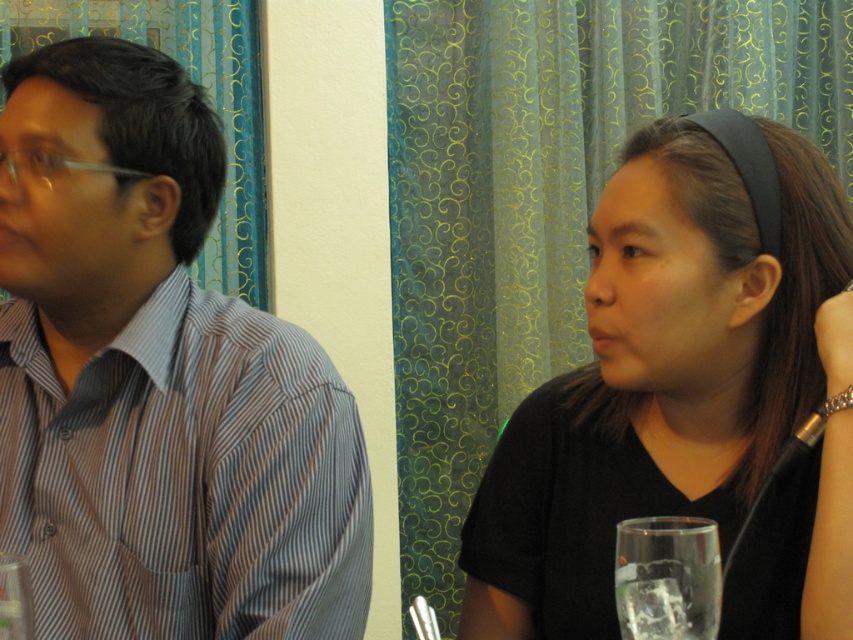
Can you confirm if striped cotton shirt at left is wider than black matte shirt at center?

Yes.

Does striped cotton shirt at left appear on the left side of black matte shirt at center?

Indeed, striped cotton shirt at left is positioned on the left side of black matte shirt at center.

Describe the element at coordinates (157, 380) in the screenshot. The height and width of the screenshot is (640, 853). I see `striped cotton shirt at left` at that location.

The image size is (853, 640). In order to click on striped cotton shirt at left in this screenshot , I will do `click(157, 380)`.

Is striped cotton shirt at left further to the viewer compared to clear glass at lower left?

Yes.

Does striped cotton shirt at left have a smaller size compared to clear glass at lower left?

No, striped cotton shirt at left is not smaller than clear glass at lower left.

Find the location of `striped cotton shirt at left`. striped cotton shirt at left is located at coordinates (157, 380).

Which of these two, striped cotton shirt at left or clear glass at lower right, stands shorter?

clear glass at lower right is shorter.

Who is taller, striped cotton shirt at left or clear glass at lower right?

With more height is striped cotton shirt at left.

Does point (138, 509) lie behind point (714, 538)?

Yes.

Where is `striped cotton shirt at left`? striped cotton shirt at left is located at coordinates (157, 380).